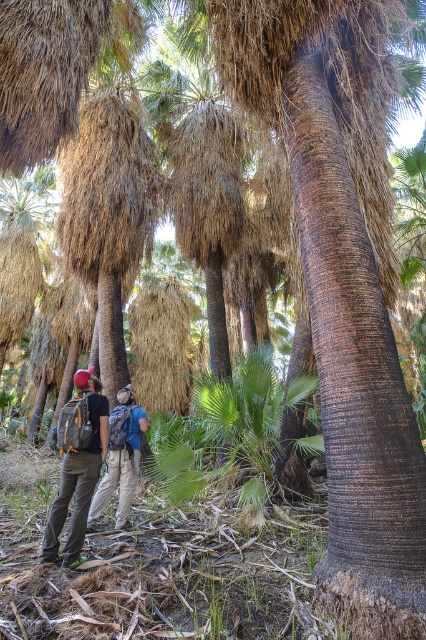
You are a hiker planning to carry both the matte gray backpack at center and the khaki pants at center. Which item should you place on top to ensure stability?

The matte gray backpack at center is taller than the khaki pants at center, so you should place the matte gray backpack at center on top to ensure stability.

You are a hiker navigating through the palm forest. You notice the matte gray backpack at center and the khaki pants at center. Which object is nearer to you as you walk through the forest?

The matte gray backpack at center is closer to the viewer than the khaki pants at center, so the matte gray backpack at center is nearer to you.

You are a hiker in the palm forest. You have a matte gray backpack at center and a camera with you. You need to place both items on a flat rock located 5 meters away from your current position. Can you fit both items on the rock without them overlapping?

The matte gray backpack at center and camera are 4.19 meters apart from each other. Since the flat rock is 5 meters away, the distance between the items is less than the rock size, so they can be placed without overlapping.